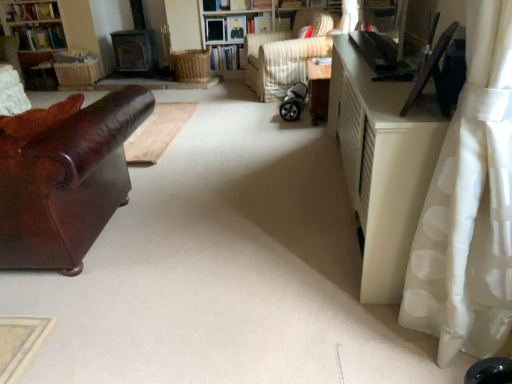
Question: Considering the positions of point (290, 105) and point (74, 162), is point (290, 105) closer or farther from the camera than point (74, 162)?

Choices:
 (A) closer
 (B) farther

Answer: (B)

Question: From the image's perspective, relative to shiny brown leather couch at left, is silver metallic baby carriage at center above or below?

Choices:
 (A) below
 (B) above

Answer: (B)

Question: Which object is positioned farthest from the woven wicker bookshelf at upper left?

Choices:
 (A) shiny brown leather couch at left
 (B) striped fabric chair at center
 (C) wooden bookshelf at center
 (D) white matte cabinet at right
 (E) white polka dot fabric at right

Answer: (E)

Question: Which object is positioned farthest from the white polka dot fabric at right?

Choices:
 (A) wooden table at center
 (B) wooden bookshelf at center
 (C) striped fabric chair at center
 (D) white matte cabinet at right
 (E) shiny brown leather couch at left

Answer: (B)